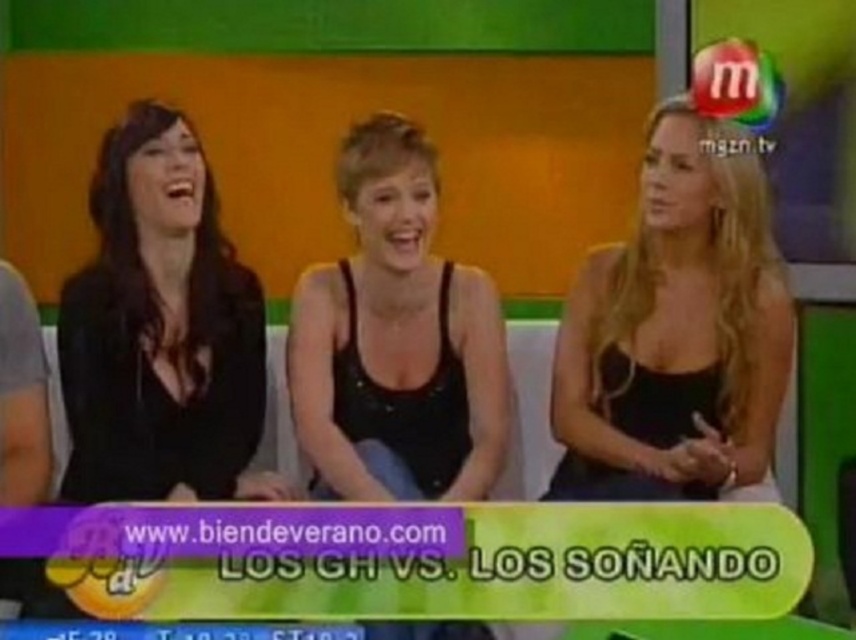
Between black matte dress at center and black matte tank top at center, which one appears on the right side from the viewer's perspective?

From the viewer's perspective, black matte dress at center appears more on the right side.

What are the coordinates of `black matte dress at center` in the screenshot? It's located at (675, 332).

Locate an element on the screen. Image resolution: width=856 pixels, height=640 pixels. black matte dress at center is located at coordinates (675, 332).

Does point (690, 410) come in front of point (215, 211)?

That is True.

Locate an element on the screen. black matte dress at center is located at coordinates (675, 332).

Is black matte dress at left further to the viewer compared to black matte tank top at center?

Yes, black matte dress at left is further from the viewer.

Describe the element at coordinates (159, 330) in the screenshot. I see `black matte dress at left` at that location.

I want to click on black matte dress at left, so click(x=159, y=330).